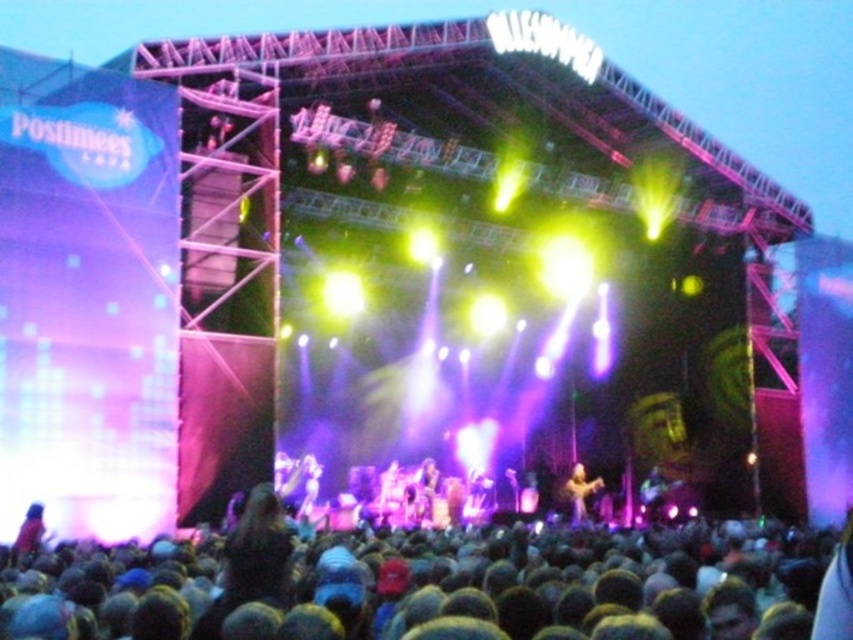
Based on the photo, does dark hair crowd at lower center have a greater width compared to shiny gold guitar at center?

Yes, dark hair crowd at lower center is wider than shiny gold guitar at center.

Describe the element at coordinates (432, 586) in the screenshot. This screenshot has width=853, height=640. I see `dark hair crowd at lower center` at that location.

This screenshot has width=853, height=640. Identify the location of dark hair crowd at lower center. (432, 586).

Is point (41, 504) positioned behind point (595, 477)?

No, (41, 504) is closer to viewer.

The image size is (853, 640). Identify the location of smooth pink shirt at lower left. (28, 536).

Can you confirm if dark hair crowd at lower center is shorter than smooth pink shirt at lower left?

Incorrect, dark hair crowd at lower center's height does not fall short of smooth pink shirt at lower left's.

Between dark hair crowd at lower center and smooth pink shirt at lower left, which one is positioned higher?

smooth pink shirt at lower left

Does point (477, 636) come behind point (38, 525)?

No, (477, 636) is in front of (38, 525).

I want to click on dark hair crowd at lower center, so click(x=432, y=586).